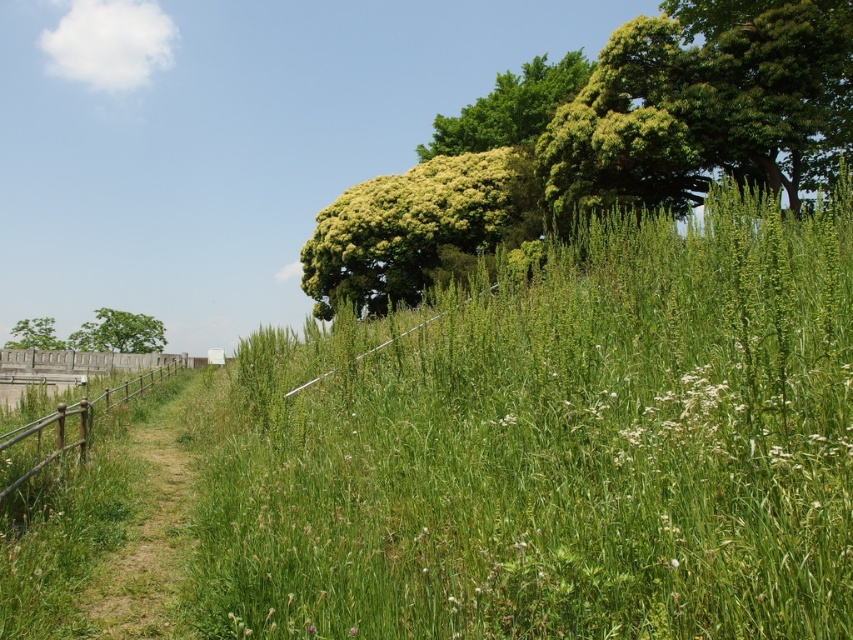
Between green leafy tree at upper center and green leafy tree at left, which one is positioned higher?

Positioned higher is green leafy tree at upper center.

Is green leafy tree at upper center wider than green leafy tree at left?

Yes, green leafy tree at upper center is wider than green leafy tree at left.

Where is `green leafy tree at upper center`? green leafy tree at upper center is located at coordinates (509, 108).

I want to click on brown wooden fence at left, so click(67, 428).

The height and width of the screenshot is (640, 853). Describe the element at coordinates (67, 428) in the screenshot. I see `brown wooden fence at left` at that location.

Find the location of a particular element. brown wooden fence at left is located at coordinates (67, 428).

What do you see at coordinates (555, 449) in the screenshot?
I see `green grassy at upper center` at bounding box center [555, 449].

Does green grassy at upper center appear on the left side of green grassy trail at lower left?

No, green grassy at upper center is not to the left of green grassy trail at lower left.

Between point (766, 564) and point (126, 563), which one is positioned behind?

Positioned behind is point (126, 563).

This screenshot has width=853, height=640. I want to click on green grassy at upper center, so click(x=555, y=449).